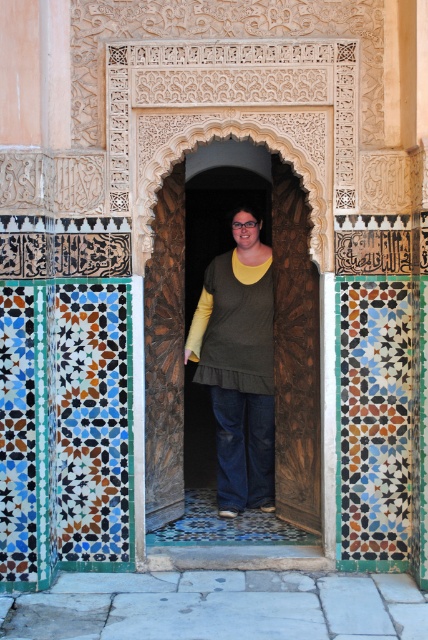
You are taking a photo of the archway and want to ensure both the point at coordinates point (174, 228) and point (231, 504) are in focus. Which point is closer to the camera and should be prioritized for focus?

Point (174, 228) is closer to the camera than point (231, 504), so it should be prioritized for focus.

You are a tour guide explaining the historical building to visitors. You point to the wooden door at center and the dark green fabric shirt at center. Which object is positioned to the right of the other?

The wooden door at center is to the right of the dark green fabric shirt at center.

You are a visitor at this historical site and want to take a photo of the wooden door at center without the dark green fabric shirt at center blocking it. Based on their heights, is it possible to frame the shot so the shirt is entirely out of the frame while keeping the door fully visible?

The wooden door at center is taller than the dark green fabric shirt at center, so it is possible to frame the shot so the shirt is entirely out of the frame while keeping the door fully visible by adjusting the camera angle to exclude the shirt without cropping the door.